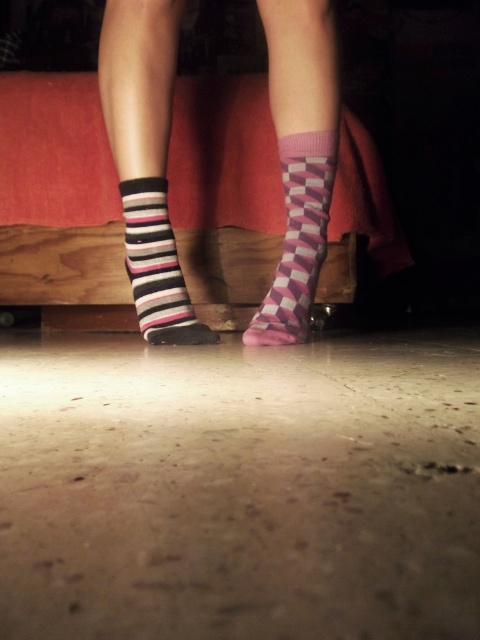
Who is taller, striped cotton socks at lower left or pink diamond-patterned socks at lower center?

striped cotton socks at lower left is taller.

Describe the element at coordinates (144, 147) in the screenshot. This screenshot has height=640, width=480. I see `striped cotton socks at lower left` at that location.

Where is `striped cotton socks at lower left`? striped cotton socks at lower left is located at coordinates (144, 147).

Can you confirm if striped socks at center is wider than pink checkered sock at center?

Yes.

Can you confirm if striped socks at center is positioned to the left of pink checkered sock at center?

Yes, striped socks at center is to the left of pink checkered sock at center.

Where is `striped socks at center`? The image size is (480, 640). striped socks at center is located at coordinates (144, 147).

Can you confirm if striped socks at center is shorter than striped cotton socks at lower left?

Yes.

Is point (181, 4) positioned before point (180, 275)?

Yes, point (181, 4) is in front of point (180, 275).

The height and width of the screenshot is (640, 480). I want to click on striped socks at center, so click(x=144, y=147).